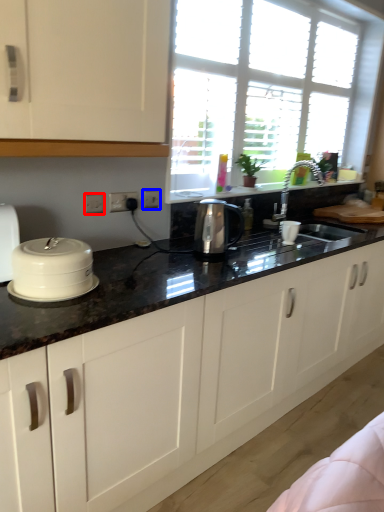
Question: Which object is further to the camera taking this photo, electric outlet (highlighted by a red box) or electric outlet (highlighted by a blue box)?

Choices:
 (A) electric outlet
 (B) electric outlet

Answer: (B)